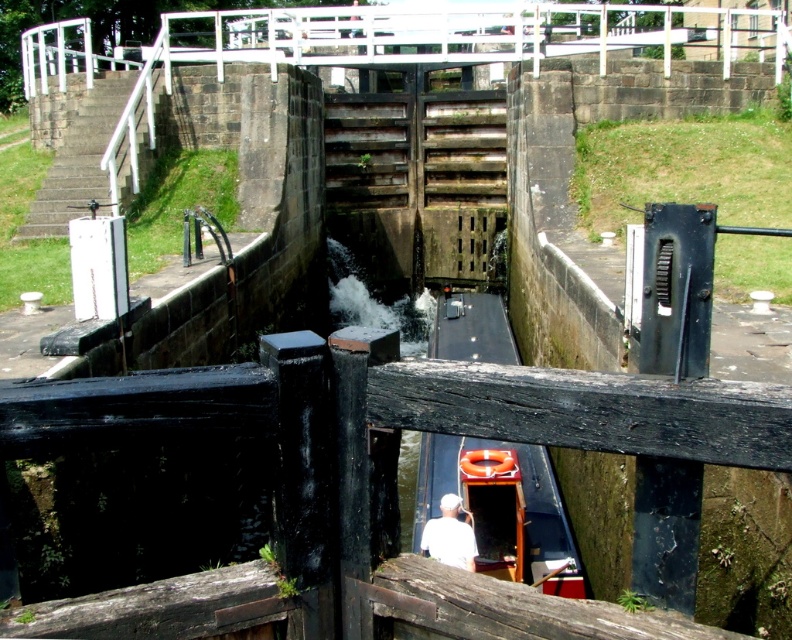
Question: Which point appears closest to the camera in this image?

Choices:
 (A) (447, 532)
 (B) (465, 499)

Answer: (A)

Question: Can you confirm if wooden boat at center is bigger than white fabric at center?

Choices:
 (A) no
 (B) yes

Answer: (B)

Question: Which point appears closest to the camera in this image?

Choices:
 (A) (478, 444)
 (B) (452, 525)

Answer: (B)

Question: Is wooden boat at center smaller than white fabric at center?

Choices:
 (A) no
 (B) yes

Answer: (A)

Question: Can you confirm if wooden boat at center is wider than white fabric at center?

Choices:
 (A) no
 (B) yes

Answer: (B)